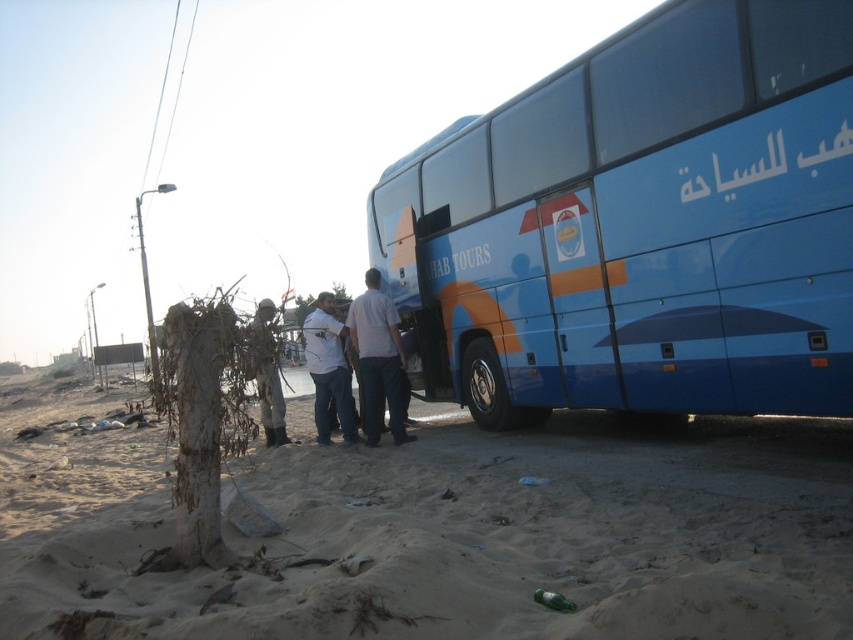
Who is lower down, blue glossy bus at right or camouflage fabric figure at center?

camouflage fabric figure at center is below.

The image size is (853, 640). Describe the element at coordinates (641, 225) in the screenshot. I see `blue glossy bus at right` at that location.

In order to click on blue glossy bus at right in this screenshot , I will do `click(641, 225)`.

Locate an element on the screen. Image resolution: width=853 pixels, height=640 pixels. blue glossy bus at right is located at coordinates (641, 225).

Can you confirm if blue glossy bus at right is positioned to the right of white cotton shirt at center?

Correct, you'll find blue glossy bus at right to the right of white cotton shirt at center.

Does point (500, 342) lie in front of point (393, 362)?

Yes, point (500, 342) is closer to viewer.

Locate an element on the screen. The image size is (853, 640). blue glossy bus at right is located at coordinates (641, 225).

Is white matte shirt at center to the left of camouflage fabric figure at center from the viewer's perspective?

Indeed, white matte shirt at center is positioned on the left side of camouflage fabric figure at center.

In the scene shown: Does white matte shirt at center appear over camouflage fabric figure at center?

Incorrect, white matte shirt at center is not positioned above camouflage fabric figure at center.

Where is `white matte shirt at center`? Image resolution: width=853 pixels, height=640 pixels. white matte shirt at center is located at coordinates (328, 369).

The height and width of the screenshot is (640, 853). Find the location of `white matte shirt at center`. white matte shirt at center is located at coordinates (328, 369).